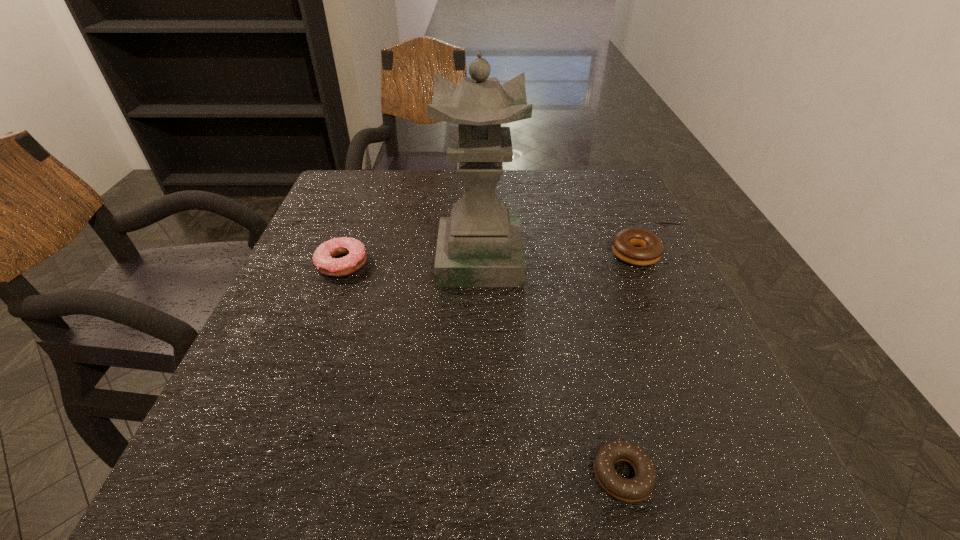
Find the location of `the third object from right to left`. the third object from right to left is located at coordinates (479, 245).

Where is `the tallest object`? The width and height of the screenshot is (960, 540). the tallest object is located at coordinates (479, 245).

Find the location of `the rightmost object`. the rightmost object is located at coordinates (649, 249).

This screenshot has width=960, height=540. In order to click on the leftmost doughnut in this screenshot , I will do `click(323, 258)`.

Where is `the shortest object`? the shortest object is located at coordinates (638, 488).

Identify the location of the nearest doughnut. The width and height of the screenshot is (960, 540). (638, 488).

Image resolution: width=960 pixels, height=540 pixels. In order to click on vacant area situated at the front opening of the tallest object in this screenshot , I will do `click(649, 259)`.

The image size is (960, 540). In order to click on vacant point located 0.100m on the left of the rightmost doughnut in this screenshot , I will do `click(566, 254)`.

The image size is (960, 540). In order to click on free spot located on the front of the leftmost doughnut in this screenshot , I will do `click(280, 432)`.

Where is `free space located on the left of the nearest doughnut`? This screenshot has height=540, width=960. free space located on the left of the nearest doughnut is located at coordinates (420, 475).